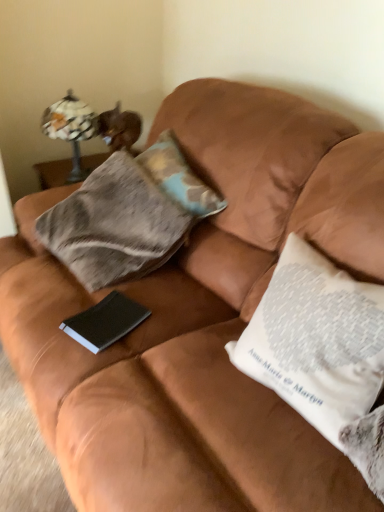
Question: From the image's perspective, is camouflage fabric pillow at center, positioned as the first pillow in top-to-bottom order, located above or below black matte paper at center?

Choices:
 (A) below
 (B) above

Answer: (B)

Question: Considering the positions of camouflage fabric pillow at center, positioned as the 2th pillow in bottom-to-top order, and black matte paper at center in the image, is camouflage fabric pillow at center, positioned as the 2th pillow in bottom-to-top order, taller or shorter than black matte paper at center?

Choices:
 (A) tall
 (B) short

Answer: (A)

Question: Which object is positioned closest to the white printed pillow at right, arranged as the 2th pillow when viewed from the back?

Choices:
 (A) black matte paper at center
 (B) matte glass lamp at upper left
 (C) camouflage fabric pillow at center, positioned as the 2th pillow in bottom-to-top order

Answer: (A)

Question: Considering the real-world distances, which object is farthest from the camouflage fabric pillow at center, which appears as the first pillow when viewed from the back?

Choices:
 (A) white printed pillow at right, placed as the 2th pillow when sorted from top to bottom
 (B) matte glass lamp at upper left
 (C) black matte paper at center

Answer: (A)